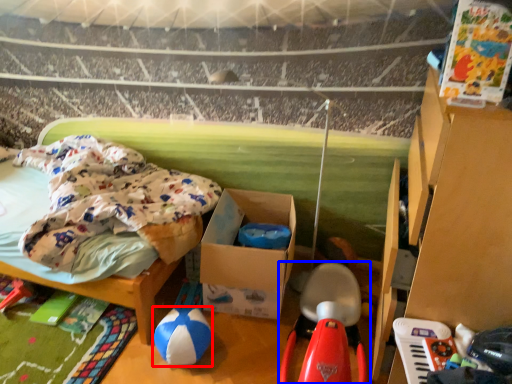
Question: Which of the following is the farthest to the observer, toy (highlighted by a red box) or toy (highlighted by a blue box)?

Choices:
 (A) toy
 (B) toy

Answer: (A)